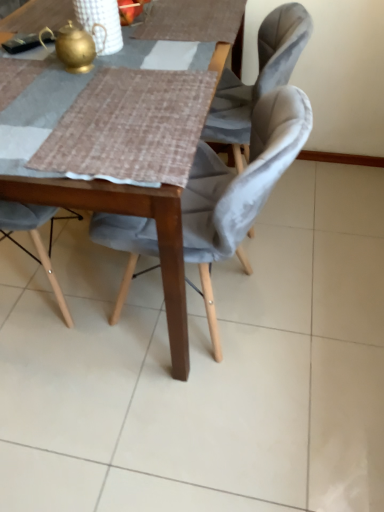
Question: From a real-world perspective, is gold metallic teapot at upper left under wooden table at center?

Choices:
 (A) yes
 (B) no

Answer: (B)

Question: Is gold metallic teapot at upper left thinner than wooden table at center?

Choices:
 (A) yes
 (B) no

Answer: (A)

Question: Is gold metallic teapot at upper left facing towards wooden table at center?

Choices:
 (A) no
 (B) yes

Answer: (A)

Question: Is wooden table at center completely or partially inside gold metallic teapot at upper left?

Choices:
 (A) yes
 (B) no

Answer: (B)

Question: Is gold metallic teapot at upper left behind wooden table at center?

Choices:
 (A) yes
 (B) no

Answer: (A)

Question: Considering the positions of wooden table at center and velvet grey chair at center in the image, is wooden table at center wider or thinner than velvet grey chair at center?

Choices:
 (A) wide
 (B) thin

Answer: (A)

Question: From a real-world perspective, is wooden table at center physically located above or below velvet grey chair at center?

Choices:
 (A) above
 (B) below

Answer: (A)

Question: Based on their positions, is wooden table at center located to the left or right of velvet grey chair at center?

Choices:
 (A) right
 (B) left

Answer: (B)

Question: From the image's perspective, relative to velvet grey chair at center, is wooden table at center above or below?

Choices:
 (A) above
 (B) below

Answer: (A)

Question: From the image's perspective, is gold metallic teapot at upper left located above or below velvet grey chair at center?

Choices:
 (A) below
 (B) above

Answer: (B)

Question: From a real-world perspective, is gold metallic teapot at upper left physically located above or below velvet grey chair at center?

Choices:
 (A) above
 (B) below

Answer: (A)

Question: Is gold metallic teapot at upper left wider or thinner than velvet grey chair at center?

Choices:
 (A) wide
 (B) thin

Answer: (B)

Question: Is gold metallic teapot at upper left to the left or to the right of velvet grey chair at center in the image?

Choices:
 (A) left
 (B) right

Answer: (A)

Question: Is velvet grey chair at center to the left or to the right of wooden table at center in the image?

Choices:
 (A) left
 (B) right

Answer: (B)

Question: Is velvet grey chair at center in front of or behind wooden table at center in the image?

Choices:
 (A) front
 (B) behind

Answer: (B)